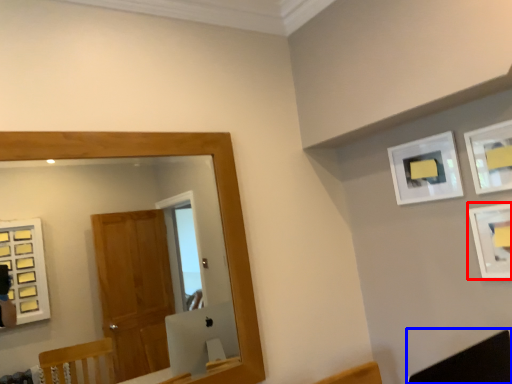
Question: Which object appears closest to the camera in this image, picture frame (highlighted by a red box) or swivel chair (highlighted by a blue box)?

Choices:
 (A) picture frame
 (B) swivel chair

Answer: (B)